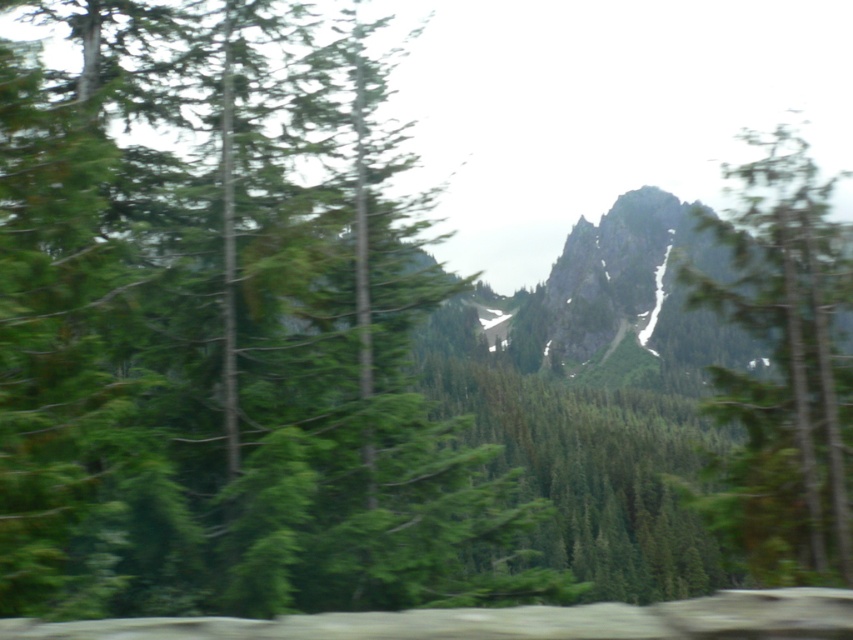
Does green matte tree at center have a larger size compared to rocky gray mountain at center?

Yes, green matte tree at center is bigger than rocky gray mountain at center.

Is green matte tree at center thinner than rocky gray mountain at center?

Indeed, green matte tree at center has a lesser width compared to rocky gray mountain at center.

Is point (19, 93) in front of point (532, 310)?

Yes.

This screenshot has width=853, height=640. Find the location of `green matte tree at center`. green matte tree at center is located at coordinates (225, 332).

Between point (811, 339) and point (525, 310), which one is positioned in front?

Point (811, 339) is in front.

Locate an element on the screen. This screenshot has width=853, height=640. green textured tree at right is located at coordinates (782, 369).

Who is more forward, (132, 484) or (814, 364)?

Point (132, 484)

Measure the distance between point (334,413) and camera.

The distance of point (334,413) from camera is 52.20 feet.

Where is `green matte tree at center`? This screenshot has width=853, height=640. green matte tree at center is located at coordinates (225, 332).